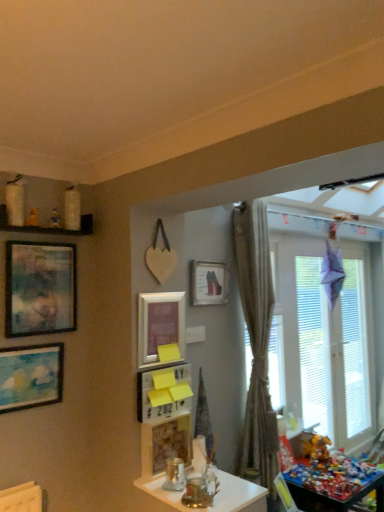
You are a GUI agent. You are given a task and a screenshot of the screen. Output one action in this format:
    pyautogui.click(x=<x>, y=<y>)
    Task: Click on the vacant area that is in front of wooden picture frame at center, which is counted as the second picture frame, starting from the right
    The image size is (384, 512).
    Given the screenshot: What is the action you would take?
    pyautogui.click(x=178, y=488)